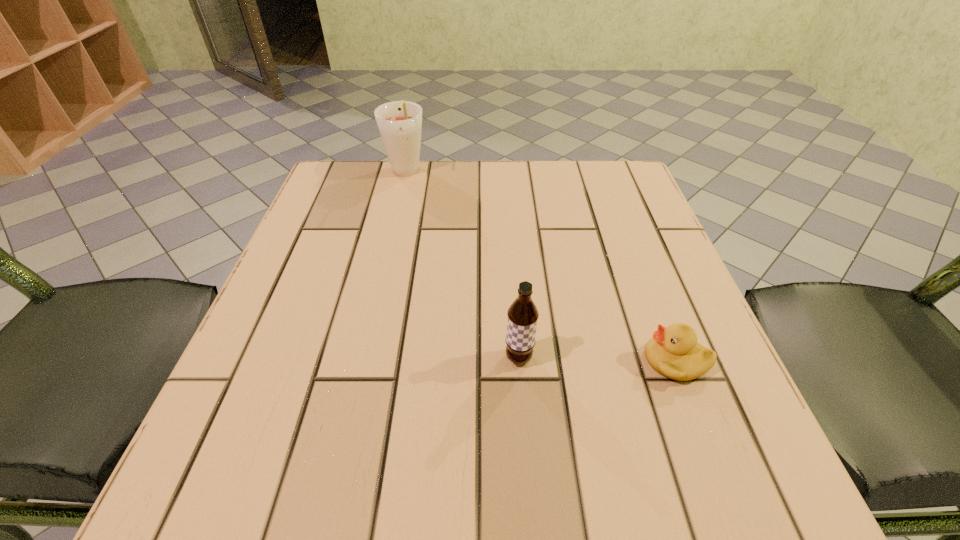
At what (x,y) coordinates should I click in order to perform the action: click on the left root beer. Please return your answer as a coordinate pair (x, y). The height and width of the screenshot is (540, 960). Looking at the image, I should click on (399, 122).

In order to click on the farthest object in this screenshot , I will do `click(399, 122)`.

At what (x,y) coordinates should I click in order to perform the action: click on the second object from left to right. Please return your answer as a coordinate pair (x, y). Looking at the image, I should click on tap(523, 314).

This screenshot has height=540, width=960. Identify the location of the right root beer. (523, 314).

What are the coordinates of `the rightmost object` in the screenshot? It's located at (674, 352).

Find the location of a particular element. duckling is located at coordinates (674, 352).

Identify the location of free space located on the drink side of the farthest object. Image resolution: width=960 pixels, height=540 pixels. (395, 217).

The width and height of the screenshot is (960, 540). Identify the location of vacant space located 0.080m on the right of the nearer root beer. (584, 358).

Find the location of a particular element. free space located 0.290m on the front-facing side of the shortest object is located at coordinates (460, 361).

You are a GUI agent. You are given a task and a screenshot of the screen. Output one action in this format:
    pyautogui.click(x=<x>, y=<y>)
    Task: Click on the vacant space situated 0.210m on the front-facing side of the shortest object
    The image size is (960, 540).
    Given the screenshot: What is the action you would take?
    pyautogui.click(x=511, y=361)